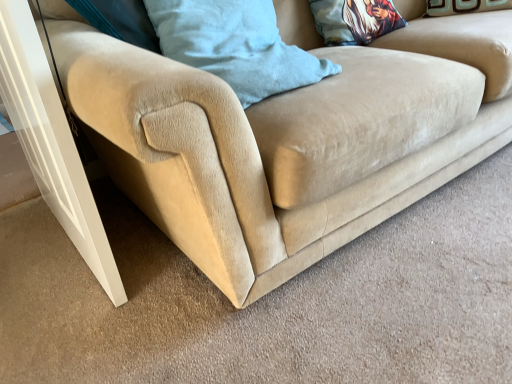
The width and height of the screenshot is (512, 384). I want to click on vacant space to the right of white glossy screen door at lower left, so click(169, 266).